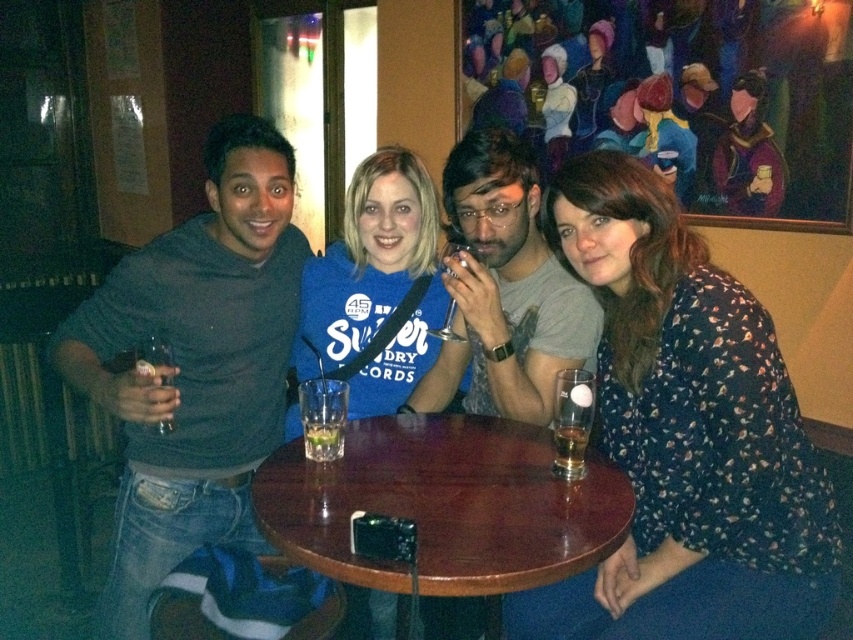
You are a bartender who needs to place a new drink order for the group. The drink must be placed exactly between the matte gray shirt at center and the translucent glass beer at table center. Is there enough space to place the new drink between them?

The distance between the matte gray shirt at center and the translucent glass beer at table center is 15.55 inches. Since the new drink only requires a small amount of space, there is enough room to place it between them.

You are standing at the entrance of the cafe and see the round wooden table with four people sitting around it. Where is the point at coordinates point (685, 436) located?

The point at coordinates point (685, 436) is located on the floral patterned dress at center.